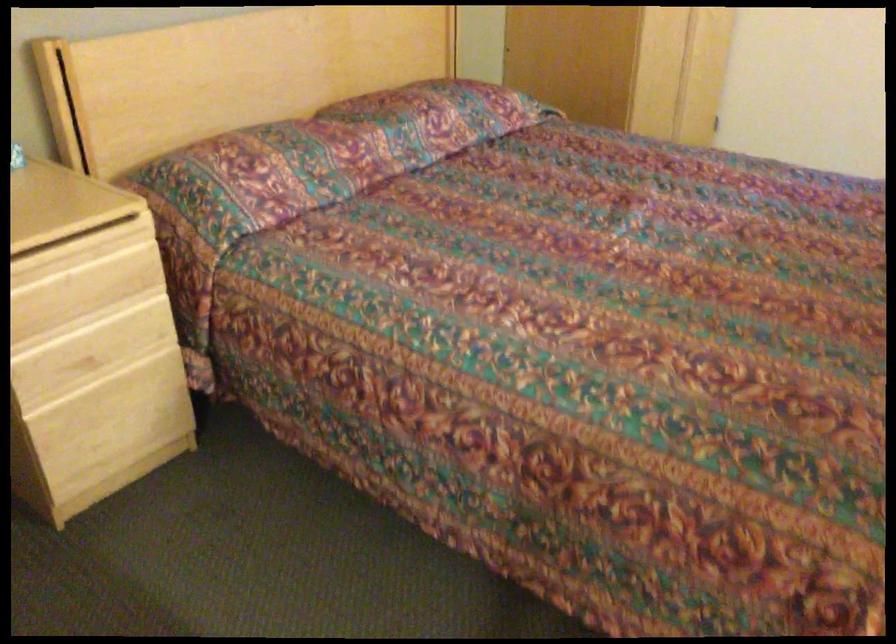
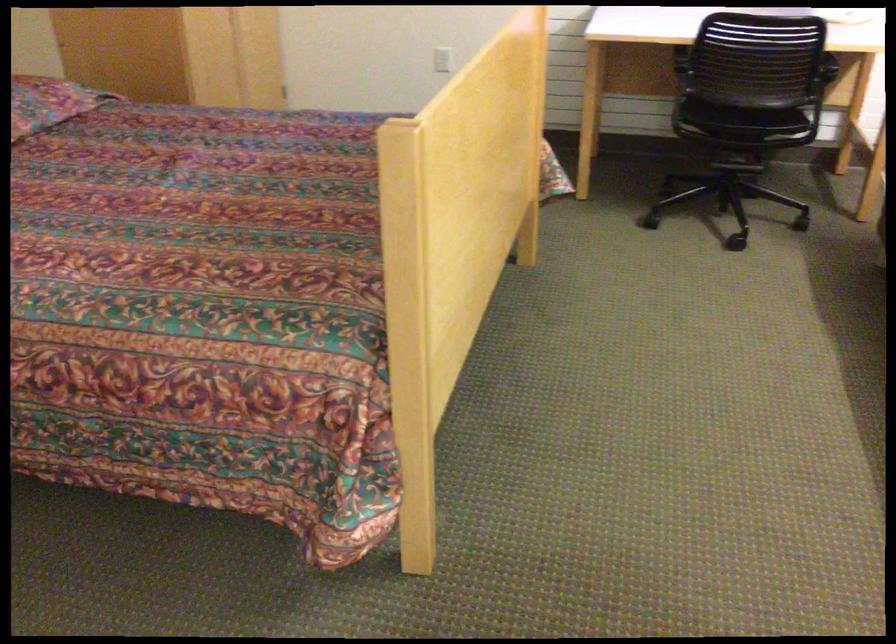
Consider the image. Which direction would the cameraman need to move to produce the second image?

The cameraman moved toward right, backward.